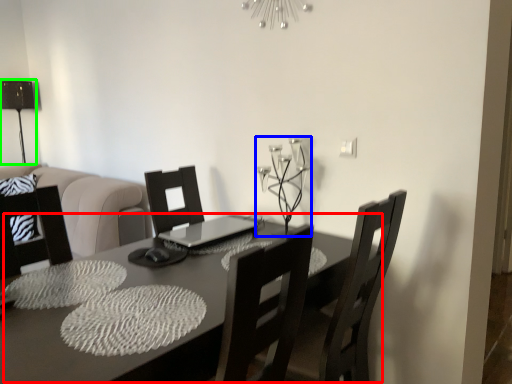
Question: Estimate the real-world distances between objects in this image. Which object is closer to table (highlighted by a red box), candle holder (highlighted by a blue box) or table lamp (highlighted by a green box)?

Choices:
 (A) candle holder
 (B) table lamp

Answer: (A)